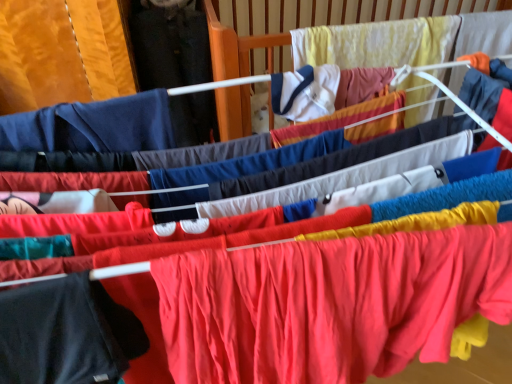
Question: Is matte red fabric at center, arranged as the second clothing when viewed from the left, positioned far away from black matte t-shirt at lower left, positioned as the second clothing in right-to-left order?

Choices:
 (A) no
 (B) yes

Answer: (A)

Question: Is matte red fabric at center, arranged as the second clothing when viewed from the left, taller than black matte t-shirt at lower left, positioned as the second clothing in right-to-left order?

Choices:
 (A) yes
 (B) no

Answer: (A)

Question: Does matte red fabric at center, which is the 1th clothing from right to left, have a lesser width compared to black matte t-shirt at lower left, acting as the first clothing starting from the left?

Choices:
 (A) yes
 (B) no

Answer: (B)

Question: Is matte red fabric at center, arranged as the second clothing when viewed from the left, at the right side of black matte t-shirt at lower left, acting as the first clothing starting from the left?

Choices:
 (A) no
 (B) yes

Answer: (B)

Question: Is the position of matte red fabric at center, which is the 1th clothing from right to left, more distant than that of black matte t-shirt at lower left, positioned as the second clothing in right-to-left order?

Choices:
 (A) yes
 (B) no

Answer: (A)

Question: Considering the positions of point (66, 370) and point (261, 34), is point (66, 370) closer or farther from the camera than point (261, 34)?

Choices:
 (A) farther
 (B) closer

Answer: (B)

Question: Considering the relative positions of black matte t-shirt at lower left, acting as the first clothing starting from the left, and yellow fabric infant bed at upper center in the image provided, is black matte t-shirt at lower left, acting as the first clothing starting from the left, to the left or to the right of yellow fabric infant bed at upper center?

Choices:
 (A) left
 (B) right

Answer: (A)

Question: Is black matte t-shirt at lower left, positioned as the second clothing in right-to-left order, taller or shorter than yellow fabric infant bed at upper center?

Choices:
 (A) tall
 (B) short

Answer: (B)

Question: From a real-world perspective, is black matte t-shirt at lower left, acting as the first clothing starting from the left, physically located above or below yellow fabric infant bed at upper center?

Choices:
 (A) above
 (B) below

Answer: (B)

Question: Considering the positions of matte red fabric at center, which is the 1th clothing from right to left, and yellow fabric infant bed at upper center in the image, is matte red fabric at center, which is the 1th clothing from right to left, bigger or smaller than yellow fabric infant bed at upper center?

Choices:
 (A) big
 (B) small

Answer: (A)

Question: Considering the positions of point (x=164, y=309) and point (x=236, y=54), is point (x=164, y=309) closer or farther from the camera than point (x=236, y=54)?

Choices:
 (A) farther
 (B) closer

Answer: (B)

Question: Is matte red fabric at center, which is the 1th clothing from right to left, to the left or to the right of yellow fabric infant bed at upper center in the image?

Choices:
 (A) right
 (B) left

Answer: (B)

Question: Is matte red fabric at center, which is the 1th clothing from right to left, inside the boundaries of yellow fabric infant bed at upper center, or outside?

Choices:
 (A) inside
 (B) outside

Answer: (B)

Question: From a real-world perspective, is matte red fabric at center, which is the 1th clothing from right to left, above or below black matte t-shirt at lower left, positioned as the second clothing in right-to-left order?

Choices:
 (A) below
 (B) above

Answer: (A)

Question: From their relative heights in the image, would you say matte red fabric at center, arranged as the second clothing when viewed from the left, is taller or shorter than black matte t-shirt at lower left, acting as the first clothing starting from the left?

Choices:
 (A) tall
 (B) short

Answer: (A)